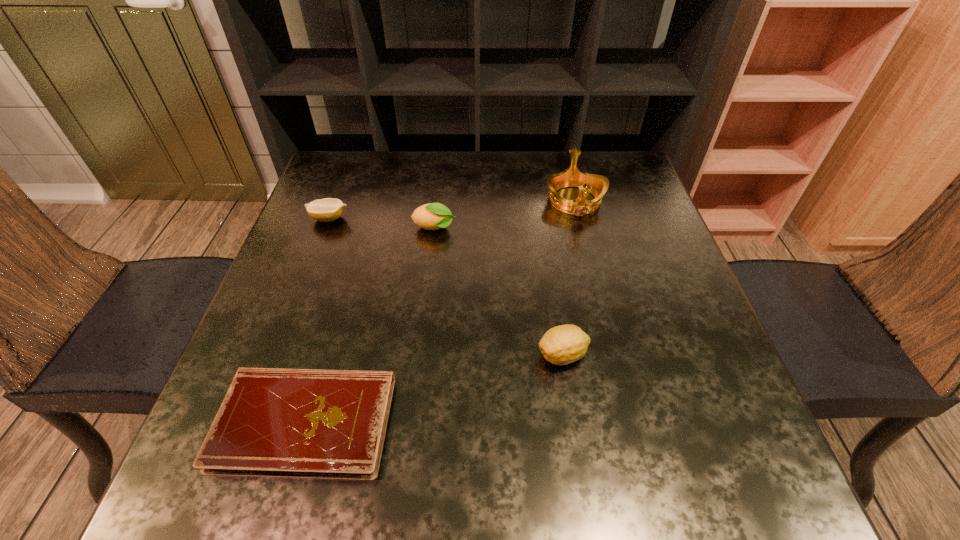
You are a GUI agent. You are given a task and a screenshot of the screen. Output one action in this format:
    pyautogui.click(x=<x>, y=<y>)
    Task: Click on the free spot that satisfies the following two spatial constraints: 1. at the front emblem of the tallest object; 2. with leaves positioned above the second lemon from left to right
    The width and height of the screenshot is (960, 540).
    Given the screenshot: What is the action you would take?
    pyautogui.click(x=581, y=228)

Image resolution: width=960 pixels, height=540 pixels. In order to click on vacant area that satisfies the following two spatial constraints: 1. on the front side of the nearest object; 2. on the left side of the fourth tallest object in this screenshot , I will do `click(252, 423)`.

The width and height of the screenshot is (960, 540). Identify the location of blank area in the image that satisfies the following two spatial constraints: 1. at the front emblem of the tallest object; 2. at the stem end of the rightmost lemon. (612, 355).